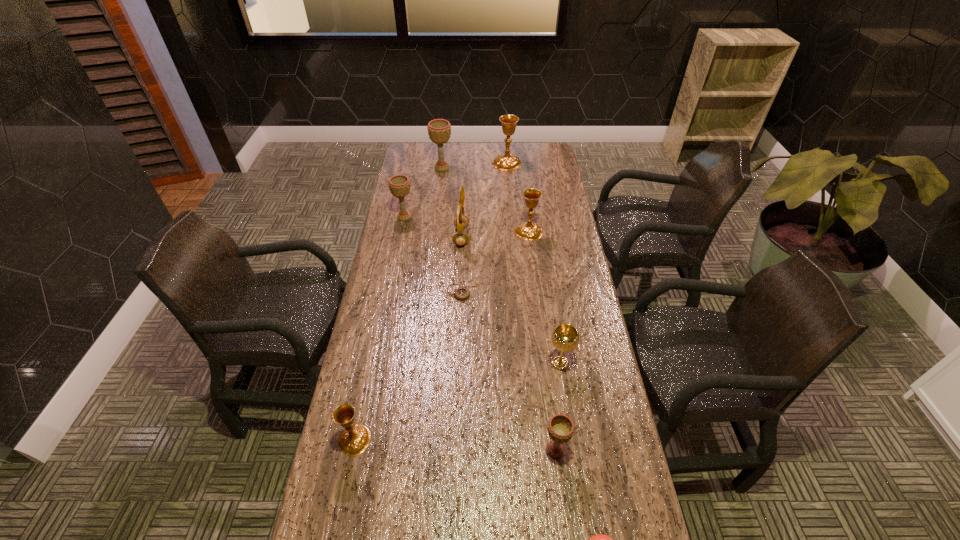
You are a GUI agent. You are given a task and a screenshot of the screen. Output one action in this format:
    pyautogui.click(x=<x>, y=<y>)
    Task: Click on the farthest gold chalice
    
    Given the screenshot: What is the action you would take?
    pyautogui.click(x=505, y=162)

Where is `the fifth chalice from right to left`? The height and width of the screenshot is (540, 960). the fifth chalice from right to left is located at coordinates (439, 130).

Locate an element on the screen. the third object from left to right is located at coordinates (439, 130).

You are a GUI agent. You are given a task and a screenshot of the screen. Output one action in this format:
    pyautogui.click(x=<x>, y=<y>)
    Task: Click on the earphone
    Image resolution: width=960 pixels, height=540 pixels.
    Given the screenshot: What is the action you would take?
    pyautogui.click(x=460, y=221)

The width and height of the screenshot is (960, 540). What are the coordinates of `the second nearest beige chalice` in the screenshot? It's located at (399, 185).

At what (x,y) coordinates should I click in order to perform the action: click on the second smallest beige chalice. Please return your answer as a coordinate pair (x, y). The width and height of the screenshot is (960, 540). Looking at the image, I should click on (399, 185).

Where is `the second farthest gold chalice`? This screenshot has width=960, height=540. the second farthest gold chalice is located at coordinates (530, 231).

You are a GUI agent. You are given a task and a screenshot of the screen. Output one action in this format:
    pyautogui.click(x=<x>, y=<y>)
    Task: Click on the seventh farthest object
    The height and width of the screenshot is (540, 960).
    Given the screenshot: What is the action you would take?
    pyautogui.click(x=565, y=337)

The image size is (960, 540). I want to click on the rightmost beige chalice, so [x=560, y=427].

This screenshot has width=960, height=540. I want to click on the smallest beige chalice, so click(560, 427).